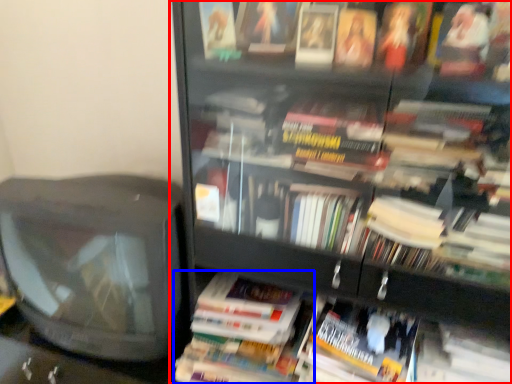
Question: Which point is further to the camera, bookcase (highlighted by a red box) or paperback book (highlighted by a blue box)?

Choices:
 (A) bookcase
 (B) paperback book

Answer: (B)